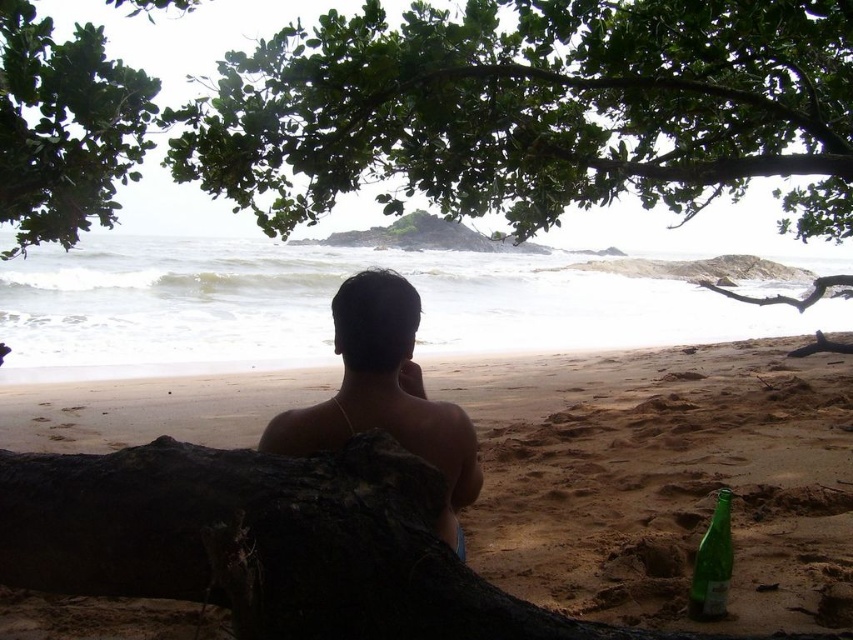
Question: Is sandy yellow at lower center positioned in front of green leafy tree at upper left?

Choices:
 (A) yes
 (B) no

Answer: (A)

Question: Does green leafy tree at upper left appear over dark skin human at center?

Choices:
 (A) yes
 (B) no

Answer: (A)

Question: Which of the following is the closest to the observer?

Choices:
 (A) (13, 184)
 (B) (526, 211)
 (C) (695, 611)
 (D) (802, 586)

Answer: (C)

Question: Which point is farther to the camera?

Choices:
 (A) sandy yellow at lower center
 (B) green leafy tree at upper center

Answer: (B)

Question: Which point appears closest to the camera in this image?

Choices:
 (A) (770, 461)
 (B) (10, 192)

Answer: (B)

Question: Does green leafy tree at upper center appear on the left side of green glass bottle at lower right?

Choices:
 (A) yes
 (B) no

Answer: (B)